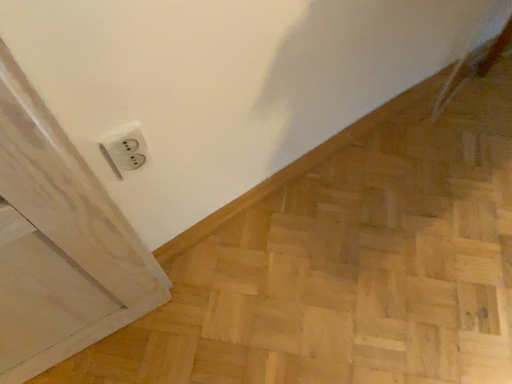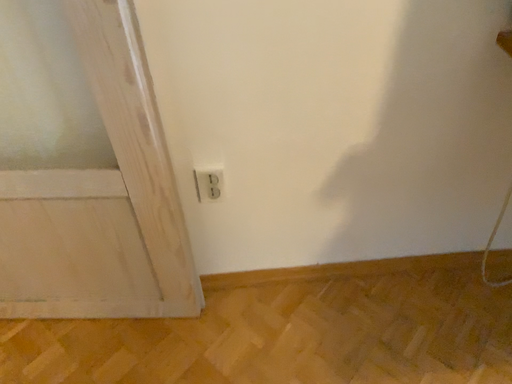
Question: Which way did the camera rotate in the video?

Choices:
 (A) rotated left
 (B) rotated right

Answer: (A)